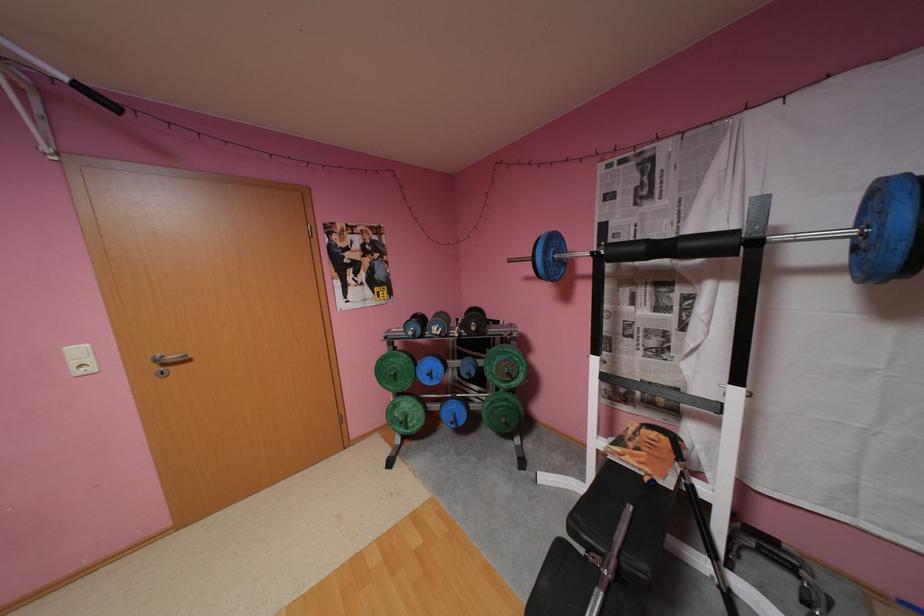
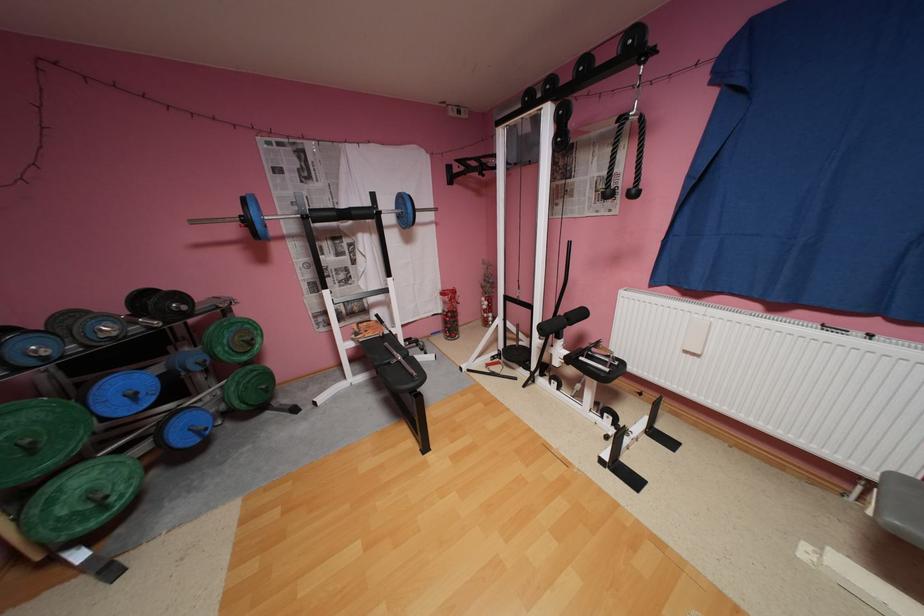
Where in the second image is the point corresponding to pixel 518 261 from the first image?

(202, 223)